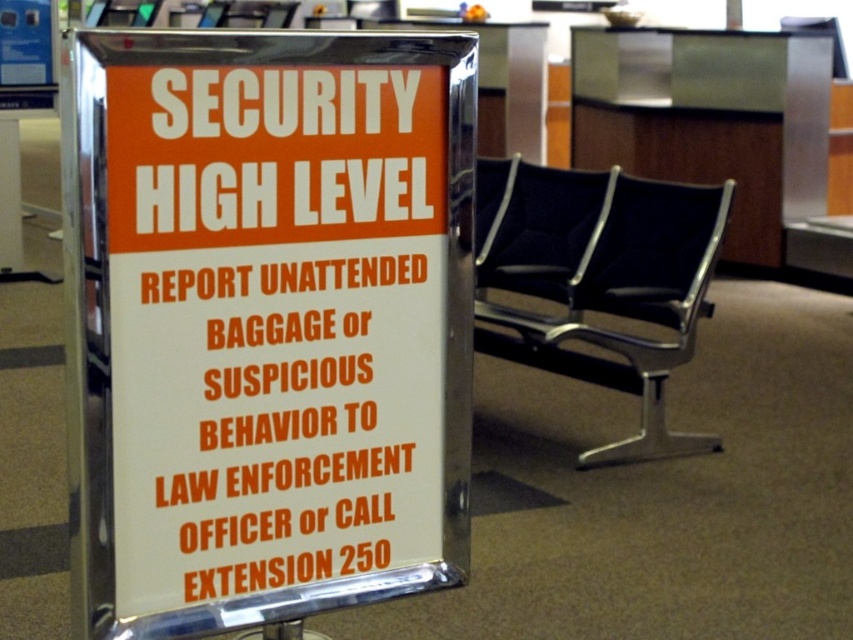
Question: Can you confirm if metallic signboard at center is positioned to the left of dark blue fabric chair at center?

Choices:
 (A) yes
 (B) no

Answer: (A)

Question: In this image, where is metallic signboard at center located relative to metallic/reflective information desk at upper center?

Choices:
 (A) below
 (B) above

Answer: (A)

Question: Among these points, which one is nearest to the camera?

Choices:
 (A) (759, 68)
 (B) (268, 525)
 (C) (500, 285)

Answer: (B)

Question: From the image, what is the correct spatial relationship of metallic signboard at center in relation to metallic/reflective information desk at upper center?

Choices:
 (A) left
 (B) right

Answer: (A)

Question: Among these points, which one is nearest to the camera?

Choices:
 (A) (135, 136)
 (B) (529, 205)

Answer: (A)

Question: Which object is positioned farthest from the metallic signboard at center?

Choices:
 (A) black fabric swivel chair at center
 (B) dark blue fabric chair at center

Answer: (B)